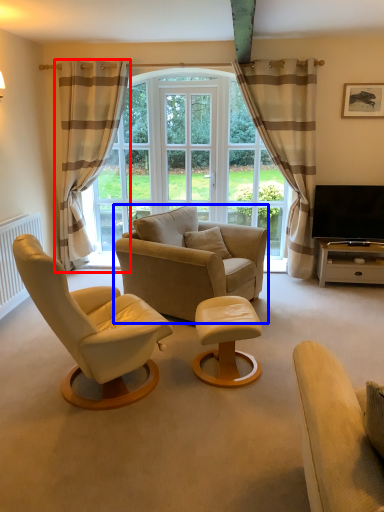
Question: Among these objects, which one is farthest to the camera, curtain (highlighted by a red box) or chair (highlighted by a blue box)?

Choices:
 (A) curtain
 (B) chair

Answer: (A)